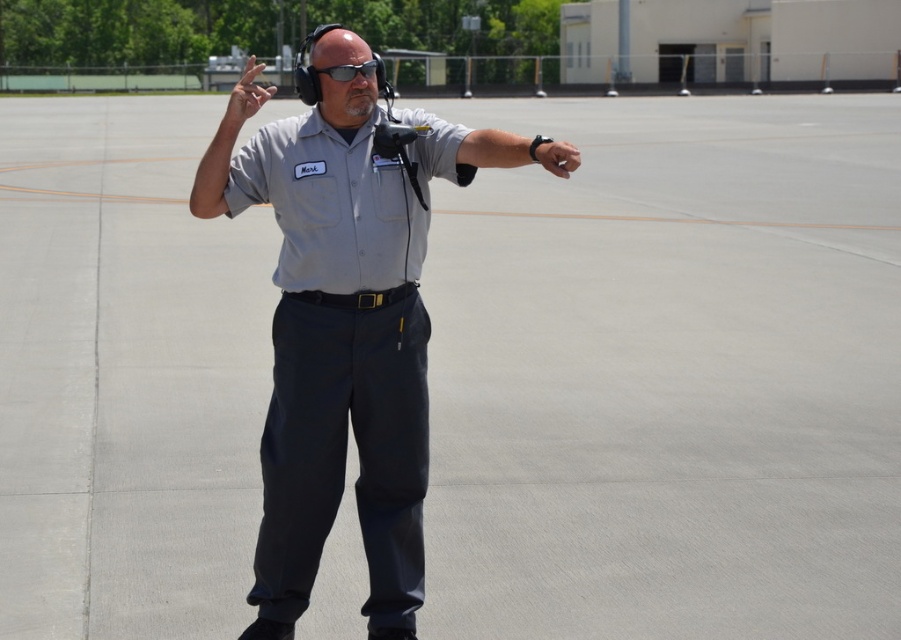
You are a drone operator controlling a drone that needs to land at point (226, 144). You see the gray fabric arm at upper center located at that point. Is there any object at the landing point that might interfere with the drone?

Yes, there is a gray fabric arm at upper center located at point (226, 144), which could interfere with the drone landing there.